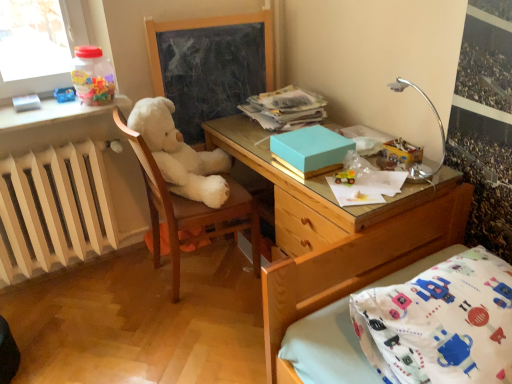
What do you see at coordinates (210, 66) in the screenshot?
I see `smooth blackboard at center` at bounding box center [210, 66].

What do you see at coordinates (424, 327) in the screenshot? I see `wooden bed frame at lower right` at bounding box center [424, 327].

What is the approximate height of white wood chair at center?

white wood chair at center is 34.03 inches tall.

How much space does matte brown teddy bear at upper right, the 2th toy when ordered from front to back, occupy vertically?

The height of matte brown teddy bear at upper right, the 2th toy when ordered from front to back, is 4.71 centimeters.

What do you see at coordinates (338, 257) in the screenshot? I see `wooden desk at center` at bounding box center [338, 257].

What do you see at coordinates (345, 177) in the screenshot? I see `yellow rubber toy car at center, the first toy positioned from the bottom` at bounding box center [345, 177].

Describe the element at coordinates (439, 129) in the screenshot. I see `silver metallic desk lamp at upper right` at that location.

Locate an element on the screen. The width and height of the screenshot is (512, 384). smooth blackboard at center is located at coordinates (210, 66).

Considering the sizes of objects silver metallic desk lamp at upper right and yellow rubber toy car at center, which is the second toy from top to bottom, in the image provided, who is wider, silver metallic desk lamp at upper right or yellow rubber toy car at center, which is the second toy from top to bottom,?

With larger width is yellow rubber toy car at center, which is the second toy from top to bottom.

Starting from the silver metallic desk lamp at upper right, which toy is the 1st one behind? Please provide its 2D coordinates.

[(345, 177)]

Could you measure the distance between silver metallic desk lamp at upper right and yellow rubber toy car at center, the first toy from the left?

They are 13.33 inches apart.

Does silver metallic desk lamp at upper right appear on the left side of yellow rubber toy car at center, the 2th toy in the back-to-front sequence?

Incorrect, silver metallic desk lamp at upper right is not on the left side of yellow rubber toy car at center, the 2th toy in the back-to-front sequence.

At what (x,y) coordinates should I click in order to perform the action: click on bed frame in front of the yellow rubber toy car at center, the first toy positioned from the bottom. Please return your answer as a coordinate pair (x, y). This screenshot has height=384, width=512. Looking at the image, I should click on (424, 327).

Does point (457, 366) lie in front of point (348, 179)?

Yes, point (457, 366) is in front of point (348, 179).

From the image's perspective, between wooden bed frame at lower right and yellow rubber toy car at center, the first toy positioned from the bottom, who is located below?

From the image's view, wooden bed frame at lower right is below.

Which of these two, yellow rubber toy car at center, the first toy positioned from the bottom, or white wood chair at center, stands taller?

white wood chair at center.

Does yellow rubber toy car at center, the 2th toy in the back-to-front sequence, have a larger size compared to white wood chair at center?

No.

Based on the photo, from the image's perspective, is yellow rubber toy car at center, which appears as the 1th toy when viewed from the front, located above white wood chair at center?

Indeed, from the image's perspective, yellow rubber toy car at center, which appears as the 1th toy when viewed from the front, is shown above white wood chair at center.

Considering the relative positions of teal matte box at center and silver metallic desk lamp at upper right in the image provided, is teal matte box at center to the right of silver metallic desk lamp at upper right from the viewer's perspective?

Incorrect, teal matte box at center is not on the right side of silver metallic desk lamp at upper right.

Is teal matte box at center far away from silver metallic desk lamp at upper right?

No, teal matte box at center is not far from silver metallic desk lamp at upper right.

Considering the sizes of objects teal matte box at center and silver metallic desk lamp at upper right in the image provided, who is shorter, teal matte box at center or silver metallic desk lamp at upper right?

Standing shorter between the two is teal matte box at center.

Can you confirm if silver metallic desk lamp at upper right is positioned to the right of teal matte box at center?

Correct, you'll find silver metallic desk lamp at upper right to the right of teal matte box at center.

Does silver metallic desk lamp at upper right have a greater height compared to teal matte box at center?

Indeed, silver metallic desk lamp at upper right has a greater height compared to teal matte box at center.

Between point (437, 112) and point (329, 154), which one is positioned behind?

The point (437, 112) is farther.

Considering the sizes of objects silver metallic desk lamp at upper right and teal matte box at center in the image provided, who is wider, silver metallic desk lamp at upper right or teal matte box at center?

Wider between the two is teal matte box at center.

Between yellow rubber toy car at center, which appears as the 1th toy when viewed from the front, and smooth blackboard at center, which one has smaller width?

smooth blackboard at center.

Which point is more distant from viewer, (346, 178) or (263, 82)?

The point (263, 82) is more distant.

From the picture: Is yellow rubber toy car at center, which appears as the 1th toy when viewed from the front, not within smooth blackboard at center?

Yes, yellow rubber toy car at center, which appears as the 1th toy when viewed from the front, is not within smooth blackboard at center.

Is yellow rubber toy car at center, which ranks as the second toy in right-to-left order, not close to smooth blackboard at center?

No, there isn't a large distance between yellow rubber toy car at center, which ranks as the second toy in right-to-left order, and smooth blackboard at center.

Which object is further away from the camera taking this photo, white wood chair at center or yellow rubber toy car at center, which is the second toy from top to bottom?

white wood chair at center is further from the camera.

Looking at this image, is there a large distance between white wood chair at center and yellow rubber toy car at center, the first toy from the left?

No, there isn't a large distance between white wood chair at center and yellow rubber toy car at center, the first toy from the left.

From the image's perspective, does white wood chair at center appear lower than yellow rubber toy car at center, which is the second toy from top to bottom?

Indeed, from the image's perspective, white wood chair at center is shown beneath yellow rubber toy car at center, which is the second toy from top to bottom.

Measure the distance from white wood chair at center to yellow rubber toy car at center, which appears as the 1th toy when viewed from the front.

A distance of 27.04 inches exists between white wood chair at center and yellow rubber toy car at center, which appears as the 1th toy when viewed from the front.

You are a GUI agent. You are given a task and a screenshot of the screen. Output one action in this format:
    pyautogui.click(x=<x>, y=<y>)
    Task: Click on the lamp above the yellow rubber toy car at center, the first toy from the left (from a real-world perspective)
    The width and height of the screenshot is (512, 384).
    Given the screenshot: What is the action you would take?
    pyautogui.click(x=439, y=129)

Where is `toy that is the 2nd object to the left of the wooden bed frame at lower right, starting at the anchor`? The image size is (512, 384). toy that is the 2nd object to the left of the wooden bed frame at lower right, starting at the anchor is located at coordinates (345, 177).

Estimate the real-world distances between objects in this image. Which object is closer to yellow rubber toy car at center, which appears as the 1th toy when viewed from the front, transparent plastic container at upper left or silver metallic desk lamp at upper right?

Among the two, silver metallic desk lamp at upper right is located nearer to yellow rubber toy car at center, which appears as the 1th toy when viewed from the front.

From the image, which object appears to be nearer to matte brown teddy bear at upper right, which is counted as the first toy, starting from the right, wooden bed frame at lower right or teal matte box at center?

teal matte box at center is positioned closer to the anchor matte brown teddy bear at upper right, which is counted as the first toy, starting from the right.

When comparing their distances from wooden bed frame at lower right, does teal matte box at center or white painted radiator at left seem closer?

The object closer to wooden bed frame at lower right is teal matte box at center.

From the image, which object appears to be nearer to smooth blackboard at center, light blue cardboard book at upper center or white painted radiator at left?

Among the two, light blue cardboard book at upper center is located nearer to smooth blackboard at center.

From the image, which object appears to be farther from white wood chair at center, teal matte box at center or light blue cardboard book at upper center?

The object further to white wood chair at center is teal matte box at center.

When comparing their distances from matte brown teddy bear at upper right, which is counted as the first toy, starting from the right, does white painted radiator at left or wooden desk at center seem closer?

Among the two, wooden desk at center is located nearer to matte brown teddy bear at upper right, which is counted as the first toy, starting from the right.

When comparing their distances from wooden bed frame at lower right, does matte brown teddy bear at upper right, placed as the 1th toy when sorted from top to bottom, or white painted radiator at left seem further?

white painted radiator at left is further to wooden bed frame at lower right.

Looking at the image, which one is located further to white wood chair at center, wooden desk at center or matte brown teddy bear at upper right, acting as the second toy starting from the left?

matte brown teddy bear at upper right, acting as the second toy starting from the left, is further to white wood chair at center.

At what (x,y) coordinates should I click in order to perform the action: click on box positioned between yellow rubber toy car at center, which is the second toy from top to bottom, and light blue cardboard book at upper center from near to far. Please return your answer as a coordinate pair (x, y). Looking at the image, I should click on (310, 151).

The height and width of the screenshot is (384, 512). I want to click on box located between smooth blackboard at center and yellow rubber toy car at center, the first toy from the left, in the left-right direction, so click(310, 151).

Identify the location of desk between transparent plastic container at upper left and wooden bed frame at lower right. (x=338, y=257).

Locate an element on the screen. The height and width of the screenshot is (384, 512). box located between white wood chair at center and yellow rubber toy car at center, which ranks as the second toy in right-to-left order, in the left-right direction is located at coordinates (310, 151).